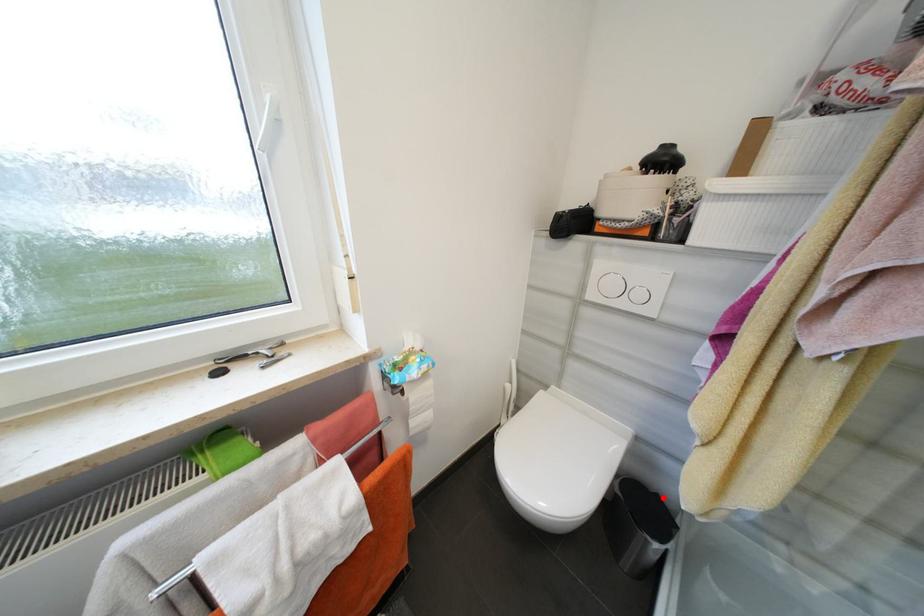
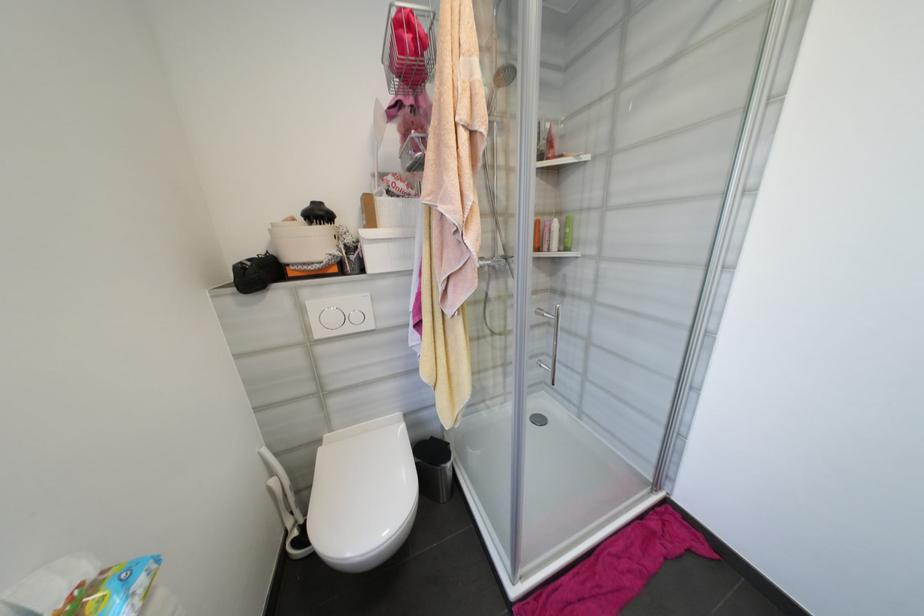
Where in the second image is the point corresponding to the highlighted location from the first image?

(438, 440)